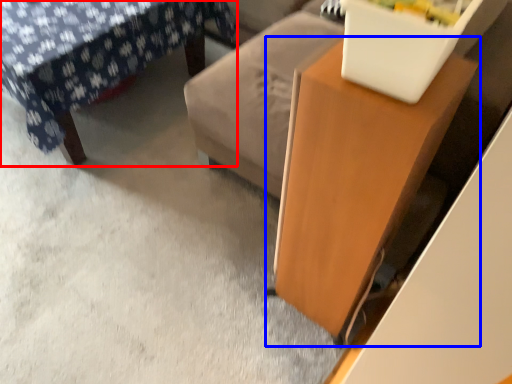
Question: Which point is further to the camera, furniture (highlighted by a red box) or table (highlighted by a blue box)?

Choices:
 (A) furniture
 (B) table

Answer: (A)